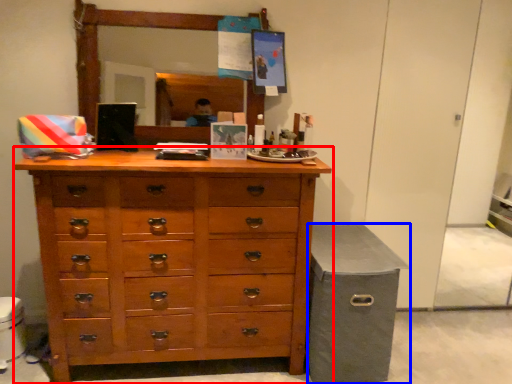
Question: Which point is further to the camera, chest of drawers (highlighted by a red box) or cabinetry (highlighted by a blue box)?

Choices:
 (A) chest of drawers
 (B) cabinetry

Answer: (B)